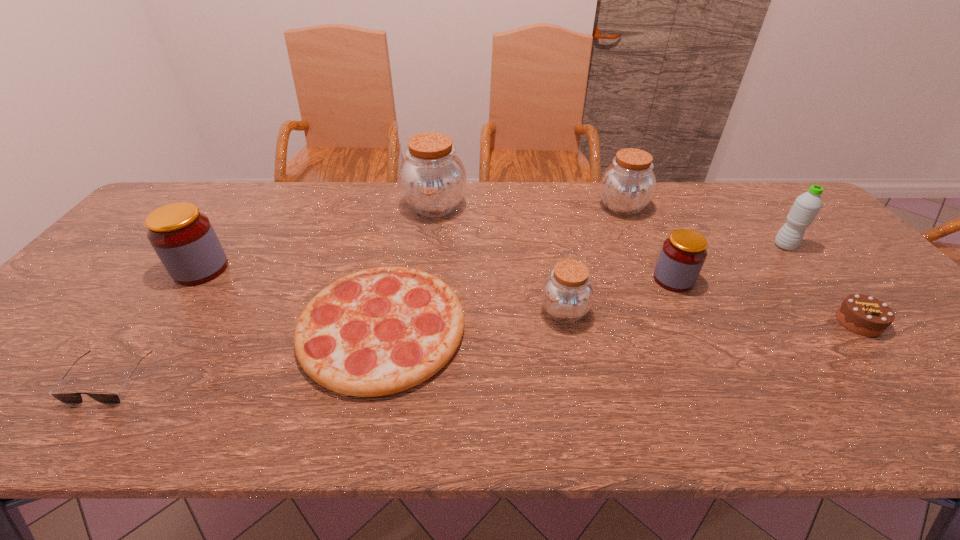
Where is `vacant region located 0.320m on the left of the chocolate cake`? The width and height of the screenshot is (960, 540). vacant region located 0.320m on the left of the chocolate cake is located at coordinates 706,322.

Image resolution: width=960 pixels, height=540 pixels. Find the location of `vacant space located 0.180m on the right of the pizza`. vacant space located 0.180m on the right of the pizza is located at coordinates (540, 328).

Locate an element on the screen. This screenshot has width=960, height=540. sunglasses that is at the near edge is located at coordinates (67, 398).

Image resolution: width=960 pixels, height=540 pixels. Find the location of `pizza located at the near edge`. pizza located at the near edge is located at coordinates [x=379, y=331].

Where is `water bottle situated at the right edge`? This screenshot has width=960, height=540. water bottle situated at the right edge is located at coordinates tap(806, 206).

I want to click on chocolate cake at the right edge, so click(862, 314).

Locate an element on the screen. free space at the far edge of the desktop is located at coordinates (728, 203).

Where is `vacant space at the near edge`? vacant space at the near edge is located at coordinates (882, 423).

Identify the location of vacant space at the left edge. This screenshot has height=540, width=960. (72, 318).

Find the location of a particular element. The image size is (960, 540). vacant space at the right edge is located at coordinates (842, 295).